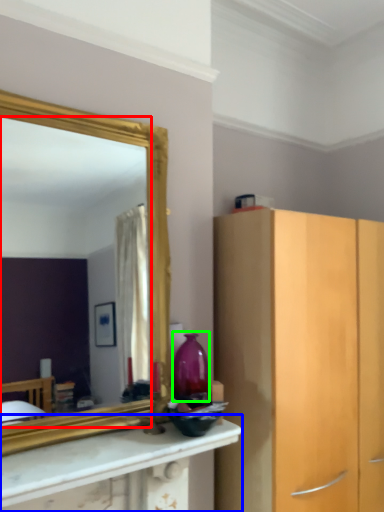
Question: Which is nearer to the mirror (highlighted by a red box)? countertop (highlighted by a blue box) or vase (highlighted by a green box).

Choices:
 (A) countertop
 (B) vase

Answer: (A)